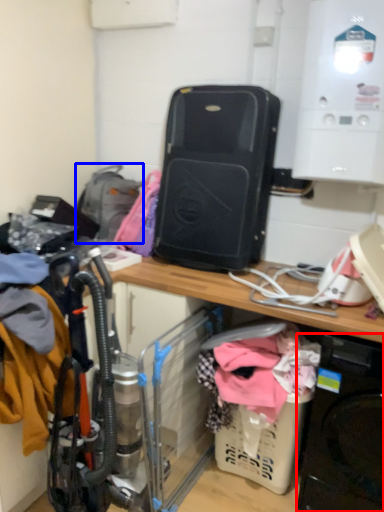
Question: Which of the following is the farthest to the observer, washing machine (highlighted by a red box) or backpack (highlighted by a blue box)?

Choices:
 (A) washing machine
 (B) backpack

Answer: (B)